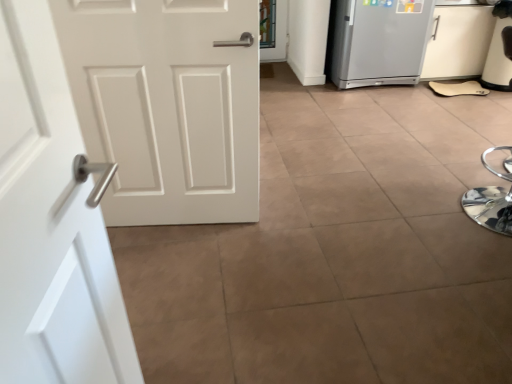
Question: Are white matte door at left and silver metallic refrigerator at upper right far apart?

Choices:
 (A) no
 (B) yes

Answer: (B)

Question: Considering the relative positions of white matte door at left and silver metallic refrigerator at upper right in the image provided, is white matte door at left behind silver metallic refrigerator at upper right?

Choices:
 (A) no
 (B) yes

Answer: (A)

Question: Does white matte door at left have a greater height compared to silver metallic refrigerator at upper right?

Choices:
 (A) no
 (B) yes

Answer: (B)

Question: Does white matte door at left have a greater width compared to silver metallic refrigerator at upper right?

Choices:
 (A) no
 (B) yes

Answer: (A)

Question: Is white matte door at left facing away from silver metallic refrigerator at upper right?

Choices:
 (A) no
 (B) yes

Answer: (A)

Question: Is white matte door at left positioned beyond the bounds of silver metallic refrigerator at upper right?

Choices:
 (A) yes
 (B) no

Answer: (A)

Question: Is silver metallic refrigerator at upper right oriented away from white matte door at left?

Choices:
 (A) no
 (B) yes

Answer: (A)

Question: Is silver metallic refrigerator at upper right not inside white matte door at left?

Choices:
 (A) yes
 (B) no

Answer: (A)

Question: From a real-world perspective, is silver metallic refrigerator at upper right on white matte door at left?

Choices:
 (A) yes
 (B) no

Answer: (B)

Question: Is silver metallic refrigerator at upper right next to white matte door at left and touching it?

Choices:
 (A) yes
 (B) no

Answer: (B)

Question: Is silver metallic refrigerator at upper right at the left side of white matte door at left?

Choices:
 (A) yes
 (B) no

Answer: (B)

Question: Considering the relative sizes of silver metallic refrigerator at upper right and white matte door at left in the image provided, is silver metallic refrigerator at upper right bigger than white matte door at left?

Choices:
 (A) no
 (B) yes

Answer: (B)

Question: Visually, is white matte door at left positioned to the left or to the right of silver metallic refrigerator at upper right?

Choices:
 (A) left
 (B) right

Answer: (A)